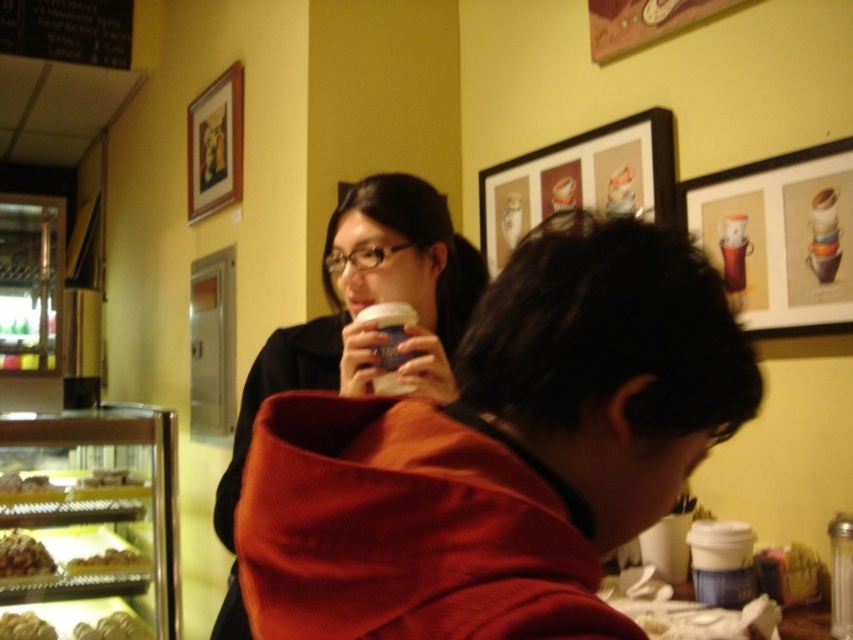
You are a customer in this cozy indoor setting and want to grab the crumbly brown pastry at lower left without touching the wooden frame at upper center. Is this possible?

The wooden frame at upper center is located above the crumbly brown pastry at lower left, so reaching down to take the pastry won???t disturb the frame.

You are standing in the cafe and want to reach the wooden frame at upper center to hang a picture. If your arm can extend 1.8 meters, can you reach it without any tools?

The wooden frame at upper center is 2.67 meters from viewer, which is beyond your arm extension of 1.8 meters. You will need a tool to reach it.

You are a customer in the cafe and want to grab the matte black coffee cup at upper center. Is the matte red hoodie at center blocking your path to it?

The matte red hoodie at center is in front of the matte black coffee cup at upper center, so yes, the matte red hoodie at center is blocking the path to the matte black coffee cup at upper center.